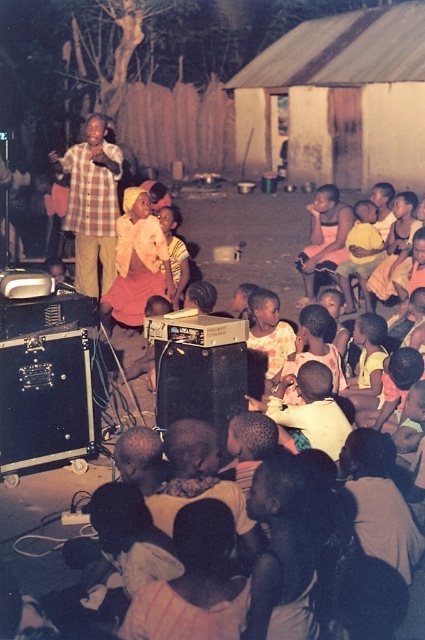
Question: Can you confirm if plaid fabric shirt at center is wider than light brown skin at center?

Choices:
 (A) yes
 (B) no

Answer: (A)

Question: Which point is farther to the camera?

Choices:
 (A) light brown skin at center
 (B) plaid fabric shirt at center

Answer: (A)

Question: Is plaid fabric shirt at center wider than light brown skin at center?

Choices:
 (A) yes
 (B) no

Answer: (A)

Question: Is plaid fabric shirt at center closer to the viewer compared to light brown skin at center?

Choices:
 (A) no
 (B) yes

Answer: (B)

Question: Which point is farther to the camera?

Choices:
 (A) (71, 160)
 (B) (164, 225)

Answer: (B)